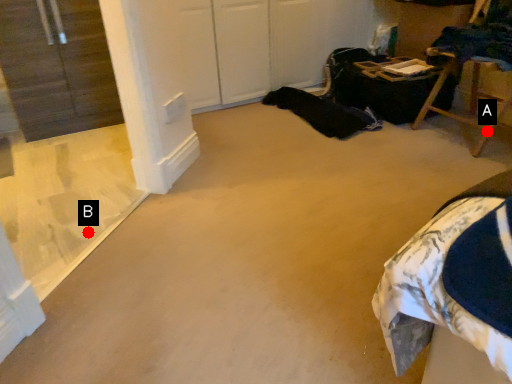
Question: Two points are circled on the image, labeled by A and B beside each circle. Which of the following is the farthest from the observer?

Choices:
 (A) A is further
 (B) B is further

Answer: (A)